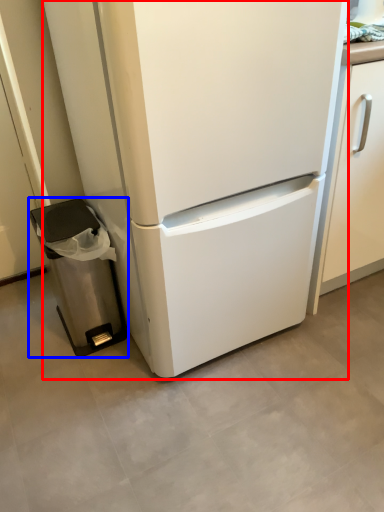
Question: Which of the following is the farthest to the observer, refrigerator (highlighted by a red box) or trash bin/can (highlighted by a blue box)?

Choices:
 (A) refrigerator
 (B) trash bin/can

Answer: (B)